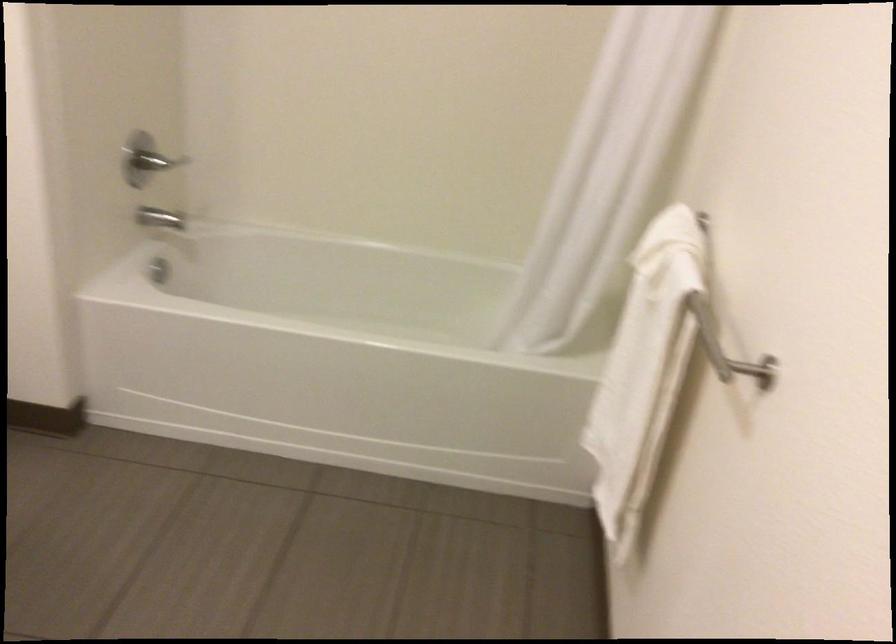
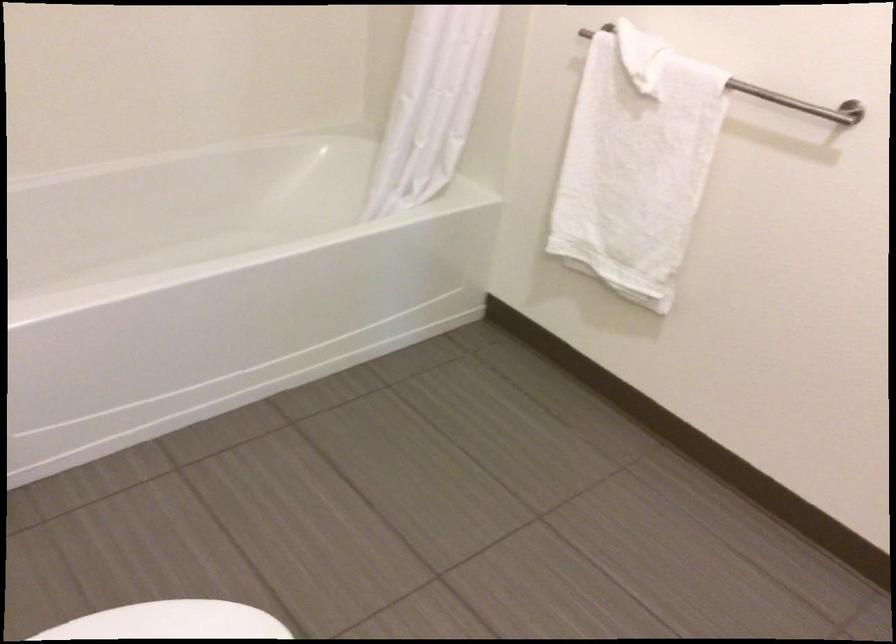
In the second image, find the point that corresponds to pixel 678 382 in the first image.

(634, 164)